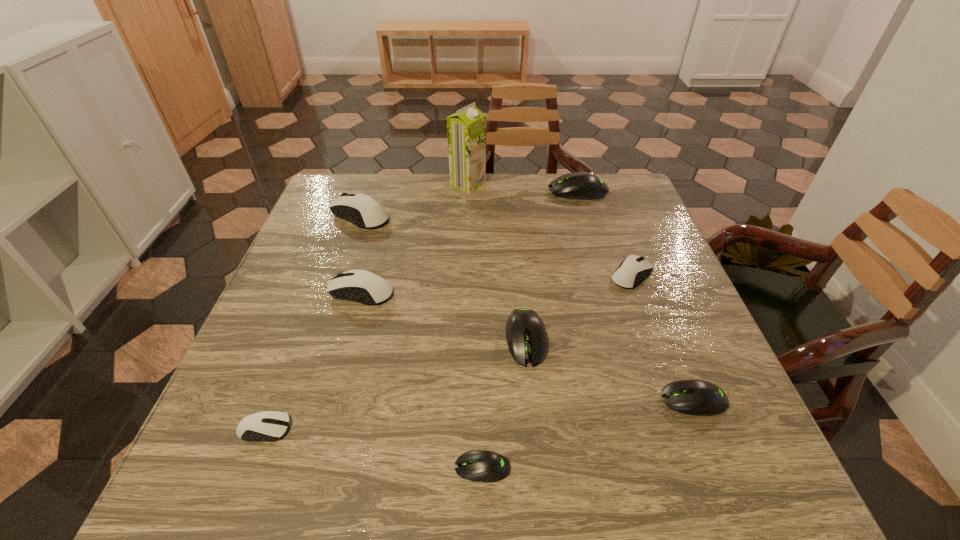
Find the location of a particular element. This screenshot has height=540, width=960. object identified as the closest to the second biggest white mouse is located at coordinates (360, 209).

Choose which computer mouse is the nearest neighbor to the farthest gray computer mouse. Please provide its 2D coordinates. Your answer should be formatted as a tuple, i.e. [(x, y)], where the tuple contains the x and y coordinates of a point satisfying the conditions above.

[(634, 269)]

Where is `computer mouse that is the closest to the farthest computer mouse`? This screenshot has width=960, height=540. computer mouse that is the closest to the farthest computer mouse is located at coordinates (634, 269).

Locate which white mouse ranks fourth in proximity to the fourth object from right to left. Please provide its 2D coordinates. Your answer should be formatted as a tuple, i.e. [(x, y)], where the tuple contains the x and y coordinates of a point satisfying the conditions above.

[(360, 209)]

The image size is (960, 540). I want to click on white mouse object that ranks as the third closest to the seventh farthest object, so click(250, 428).

The image size is (960, 540). Identify the location of the third closest gray computer mouse to the rightmost white mouse. (579, 185).

Locate which gray computer mouse is the closest to the rightmost white mouse. Please provide its 2D coordinates. Your answer should be formatted as a tuple, i.e. [(x, y)], where the tuple contains the x and y coordinates of a point satisfying the conditions above.

[(525, 337)]

Image resolution: width=960 pixels, height=540 pixels. Identify the location of vacant position in the image that satisfies the following two spatial constraints: 1. on the back side of the farthest white mouse; 2. on the left side of the soya milk. (372, 184).

This screenshot has width=960, height=540. I want to click on vacant point that satisfies the following two spatial constraints: 1. on the wheel side of the sixth object from left to right; 2. on the wheel side of the nearest gray computer mouse, so click(538, 468).